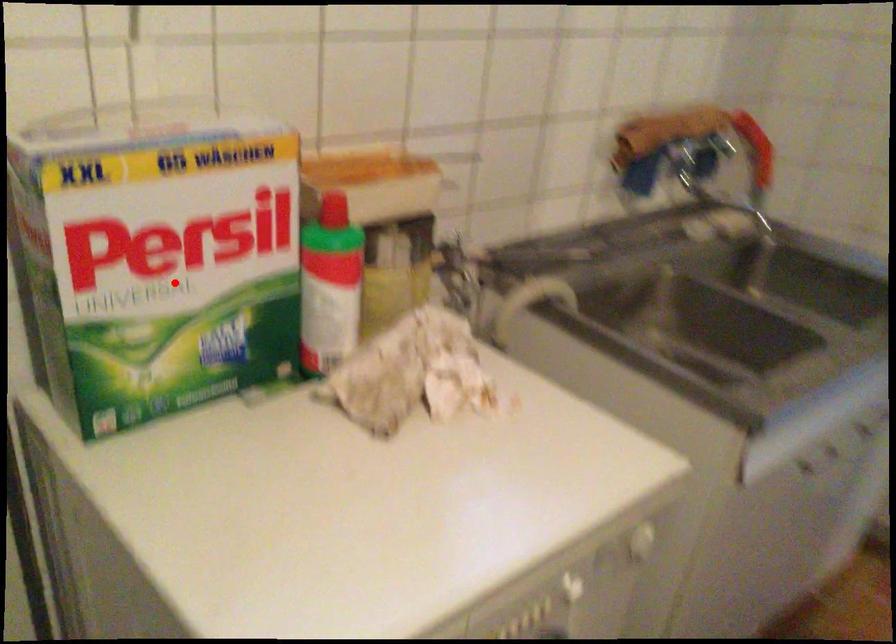
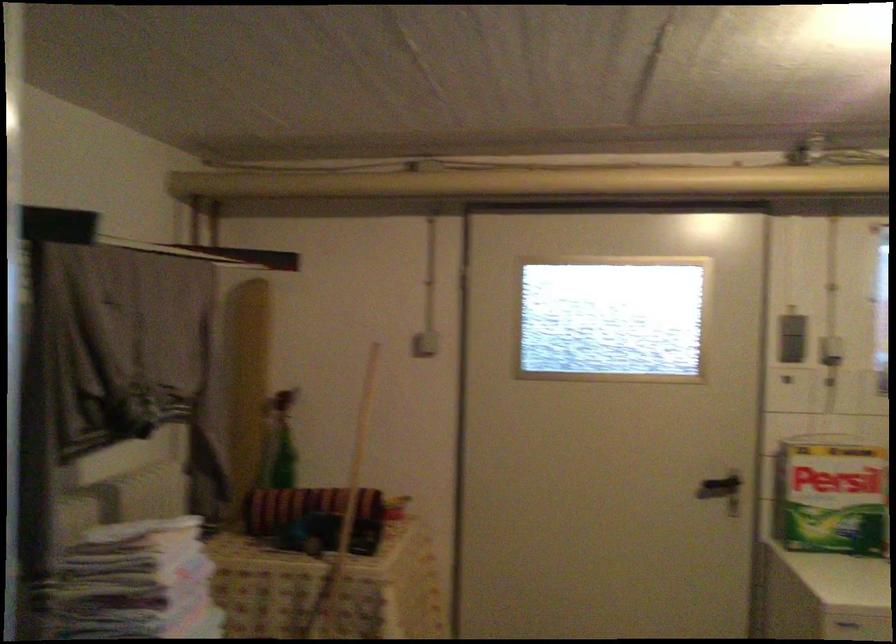
Question: I am providing you with two images of the same scene from different viewpoints. Image1 has a red point marked. In image2, the corresponding 3D location appears at what relative position? Reply with the corresponding letter.

Choices:
 (A) Closer
 (B) Farther

Answer: (B)